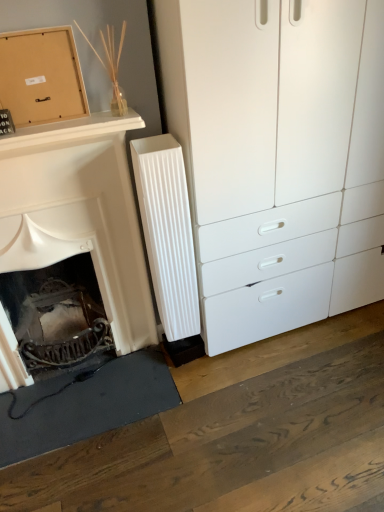
Locate an element on the screen. The height and width of the screenshot is (512, 384). free location to the right of white matte fireplace at left is located at coordinates (213, 397).